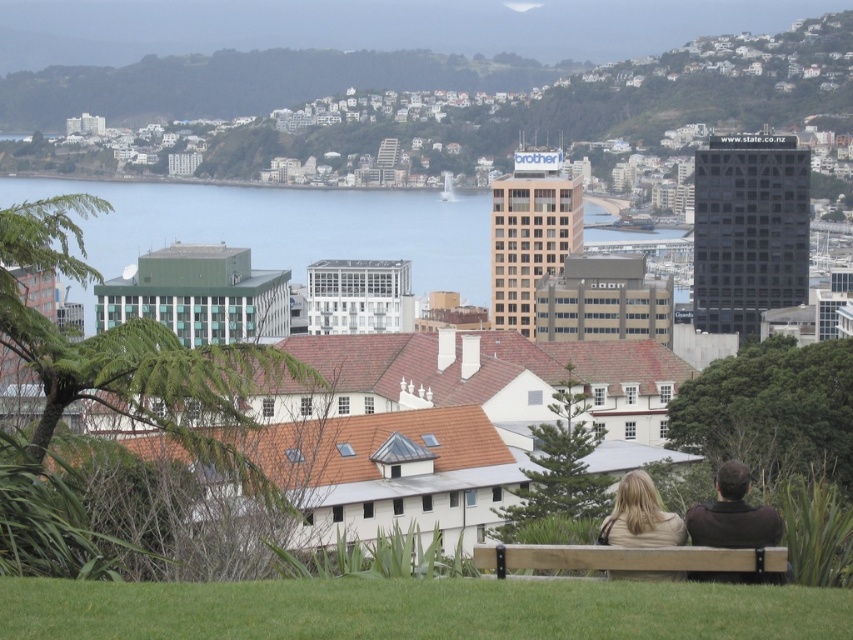
Question: Which of the following is the farthest from the observer?

Choices:
 (A) (691, 525)
 (B) (389, 243)
 (C) (740, 548)
 (D) (637, 490)

Answer: (B)

Question: Where is brown wooden bench at lower center located in relation to light brown leather bench at lower center in the image?

Choices:
 (A) below
 (B) above

Answer: (A)

Question: Which of the following is the closest to the observer?

Choices:
 (A) clear blue water at center
 (B) brown wooden bench at lower center
 (C) light brown leather bench at lower center

Answer: (B)

Question: Is clear blue water at center smaller than light brown leather bench at lower center?

Choices:
 (A) yes
 (B) no

Answer: (B)

Question: Does brown wooden bench at lower center have a smaller size compared to light brown leather jacket at lower center?

Choices:
 (A) no
 (B) yes

Answer: (B)

Question: Which point is farther from the camera taking this photo?

Choices:
 (A) (706, 502)
 (B) (634, 486)
 (C) (451, 280)
 (D) (685, 563)

Answer: (C)